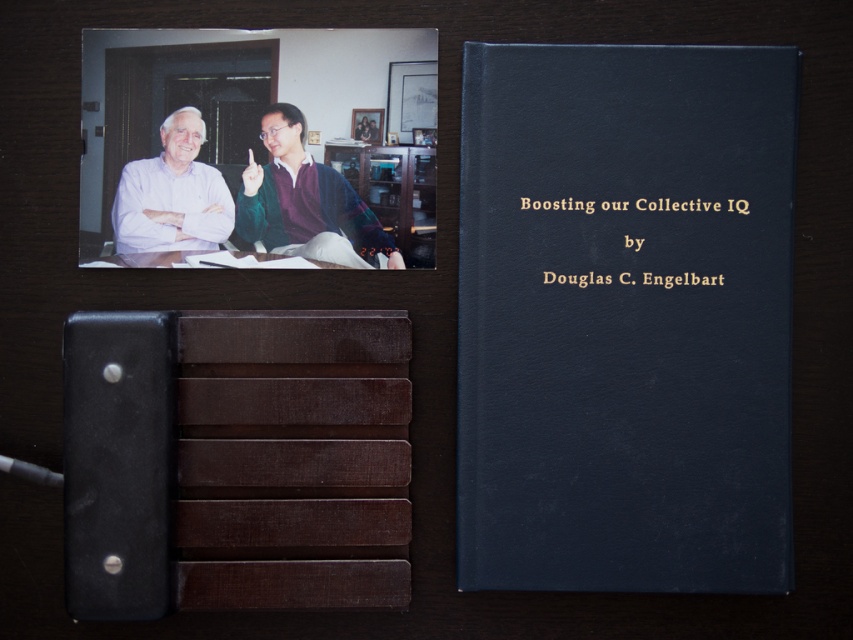
Question: From the image, what is the correct spatial relationship of matte white shirt at upper left in relation to brown wood table at center?

Choices:
 (A) left
 (B) right

Answer: (A)

Question: Which point is farther from the camera taking this photo?

Choices:
 (A) (126, 248)
 (B) (405, 227)

Answer: (B)

Question: Does dark blue leather book at center appear on the right side of brown wood table at center?

Choices:
 (A) no
 (B) yes

Answer: (B)

Question: Is matte white shirt at upper left to the right of brown wood table at center from the viewer's perspective?

Choices:
 (A) no
 (B) yes

Answer: (A)

Question: Estimate the real-world distances between objects in this image. Which object is farther from the brown wood table at center?

Choices:
 (A) dark blue leather book at center
 (B) green sweater at upper center
 (C) matte white shirt at upper left

Answer: (A)

Question: Which object is closer to the camera taking this photo?

Choices:
 (A) matte white shirt at upper left
 (B) dark blue leather book at center
 (C) green sweater at upper center
 (D) brown wood table at center

Answer: (B)